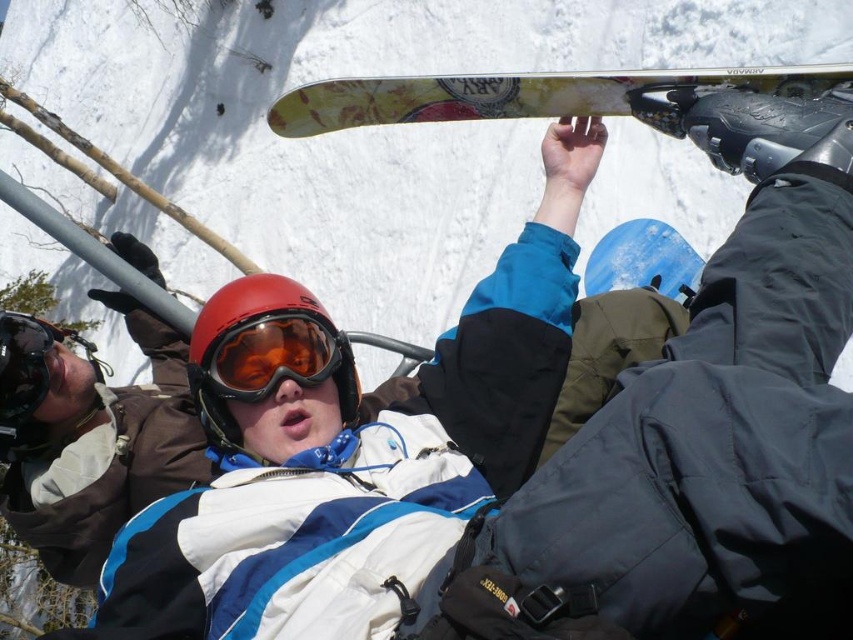
Which is behind, point (337, 332) or point (9, 342)?

Point (9, 342)

Who is more forward, [270,342] or [16,358]?

Positioned in front is point [270,342].

Describe the element at coordinates (273, 358) in the screenshot. I see `matte orange ski goggles at center` at that location.

Identify the location of matte orange ski goggles at center. (273, 358).

In the scene shown: Which of these two, yellowish wood snowboard at upper center or matte black goggles at upper center, stands shorter?

yellowish wood snowboard at upper center is shorter.

Does point (537, 115) lie in front of point (6, 413)?

No, it is behind (6, 413).

Who is more forward, (612, 113) or (9, 403)?

Positioned in front is point (9, 403).

At what (x,y) coordinates should I click in order to perform the action: click on yellowish wood snowboard at upper center. Please return your answer as a coordinate pair (x, y). Looking at the image, I should click on (509, 93).

Between point (634, 273) and point (9, 320), which one is positioned behind?

Point (634, 273)

Describe the element at coordinates (643, 260) in the screenshot. I see `blue matte snowboard at center` at that location.

Is point (677, 248) closer to camera compared to point (4, 337)?

No, (677, 248) is further to viewer.

What are the coordinates of `blue matte snowboard at center` in the screenshot? It's located at coord(643,260).